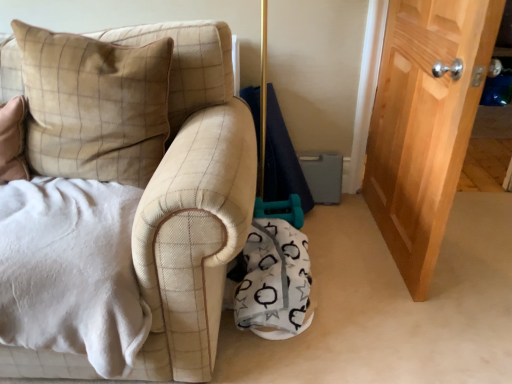
Question: Is wooden door at right bigger or smaller than white fabric blanket at lower center?

Choices:
 (A) small
 (B) big

Answer: (B)

Question: Is wooden door at right inside the boundaries of white fabric blanket at lower center, or outside?

Choices:
 (A) inside
 (B) outside

Answer: (B)

Question: Based on their relative distances, which object is farther from the wooden door at right?

Choices:
 (A) beige velvety pillow at left
 (B) white fabric blanket at lower center

Answer: (A)

Question: Considering the real-world distances, which object is farthest from the beige velvety pillow at left?

Choices:
 (A) white fabric blanket at lower center
 (B) wooden door at right

Answer: (B)